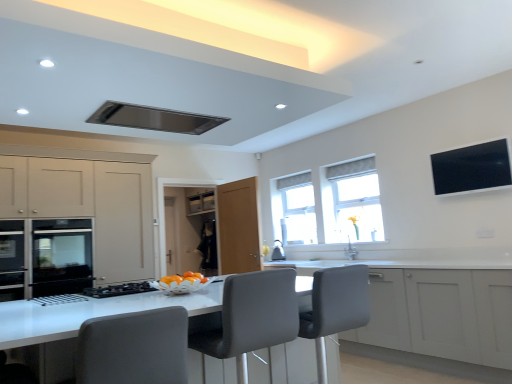
Question: Which direction should I rotate to look at white matte cabinet at center, which appears as the 1th cabinetry when viewed from the right?

Choices:
 (A) left
 (B) right

Answer: (B)

Question: Considering the relative sizes of white fabric window at upper right, marked as the 2th window in a back-to-front arrangement, and satin metallic exhaust hood at upper center in the image provided, is white fabric window at upper right, marked as the 2th window in a back-to-front arrangement, smaller than satin metallic exhaust hood at upper center?

Choices:
 (A) no
 (B) yes

Answer: (A)

Question: From a real-world perspective, is white fabric window at upper right, placed as the 2th window when sorted from left to right, over satin metallic exhaust hood at upper center?

Choices:
 (A) yes
 (B) no

Answer: (B)

Question: From the image's perspective, is white fabric window at upper right, the 1th window positioned from the right, on satin metallic exhaust hood at upper center?

Choices:
 (A) yes
 (B) no

Answer: (B)

Question: Does white fabric window at upper right, marked as the 2th window in a back-to-front arrangement, have a lesser height compared to satin metallic exhaust hood at upper center?

Choices:
 (A) yes
 (B) no

Answer: (B)

Question: Is white fabric window at upper right, marked as the 2th window in a back-to-front arrangement, turned away from satin metallic exhaust hood at upper center?

Choices:
 (A) yes
 (B) no

Answer: (B)

Question: Is white fabric window at upper right, marked as the 1th window in a front-to-back arrangement, at the left side of satin metallic exhaust hood at upper center?

Choices:
 (A) no
 (B) yes

Answer: (A)

Question: Is the position of white glossy counter at center more distant than that of grey fabric chair at center?

Choices:
 (A) no
 (B) yes

Answer: (A)

Question: Is white glossy counter at center taller than grey fabric chair at center?

Choices:
 (A) no
 (B) yes

Answer: (B)

Question: Is there a large distance between white glossy counter at center and grey fabric chair at center?

Choices:
 (A) yes
 (B) no

Answer: (A)

Question: From a real-world perspective, is white glossy counter at center over grey fabric chair at center?

Choices:
 (A) yes
 (B) no

Answer: (B)

Question: Is white glossy counter at center outside of grey fabric chair at center?

Choices:
 (A) yes
 (B) no

Answer: (A)

Question: Considering the relative positions of white glossy counter at center and grey fabric chair at center in the image provided, is white glossy counter at center to the left of grey fabric chair at center from the viewer's perspective?

Choices:
 (A) yes
 (B) no

Answer: (A)

Question: From the image's perspective, is transparent glass window at center, the second window when ordered from right to left, over gray fabric swivel chair at center, placed as the first swivel chair when sorted from left to right?

Choices:
 (A) no
 (B) yes

Answer: (B)